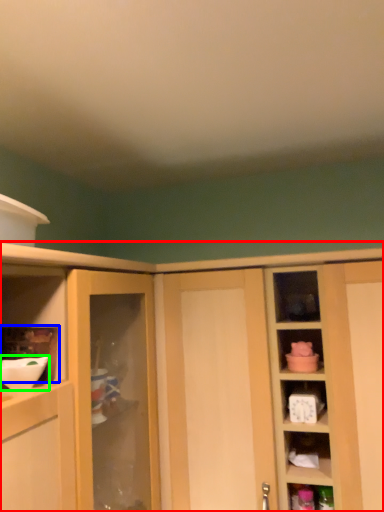
Question: Estimate the real-world distances between objects in this image. Which object is farther from cabinetry (highlighted by a red box), shelf (highlighted by a blue box) or mixing bowl (highlighted by a green box)?

Choices:
 (A) shelf
 (B) mixing bowl

Answer: (B)